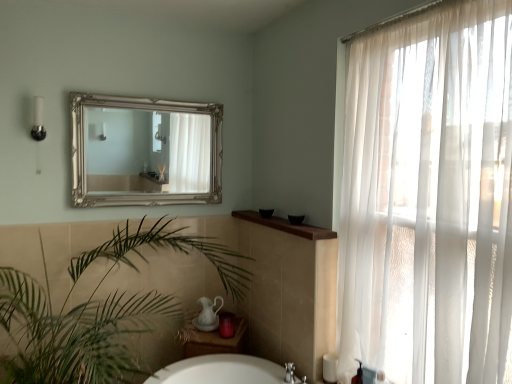
Question: Is green leafy plant at lower left in front of or behind silver ornate mirror at upper center in the image?

Choices:
 (A) front
 (B) behind

Answer: (A)

Question: From the image's perspective, is green leafy plant at lower left above or below silver ornate mirror at upper center?

Choices:
 (A) below
 (B) above

Answer: (A)

Question: Estimate the real-world distances between objects in this image. Which object is closer to the silver ornate mirror at upper center?

Choices:
 (A) sheer white curtain at right
 (B) green leafy plant at lower left
 (C) black plastic soap dispenser at lower right
 (D) brown wood counter top at upper center

Answer: (B)

Question: Based on their relative distances, which object is farther from the black plastic soap dispenser at lower right?

Choices:
 (A) brown wood counter top at upper center
 (B) silver ornate mirror at upper center
 (C) sheer white curtain at right
 (D) green leafy plant at lower left

Answer: (B)